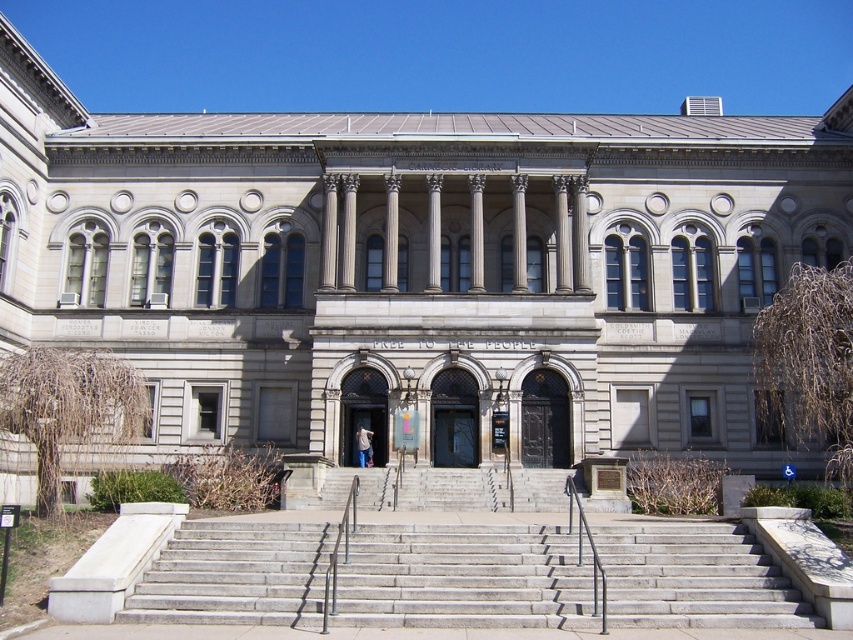
Can you confirm if gray concrete stairs at center is thinner than polished metal railing at center?

No.

How far apart are gray concrete stairs at center and polished metal railing at center?

They are 6.59 meters apart.

Where is `gray concrete stairs at center`? Image resolution: width=853 pixels, height=640 pixels. gray concrete stairs at center is located at coordinates (463, 577).